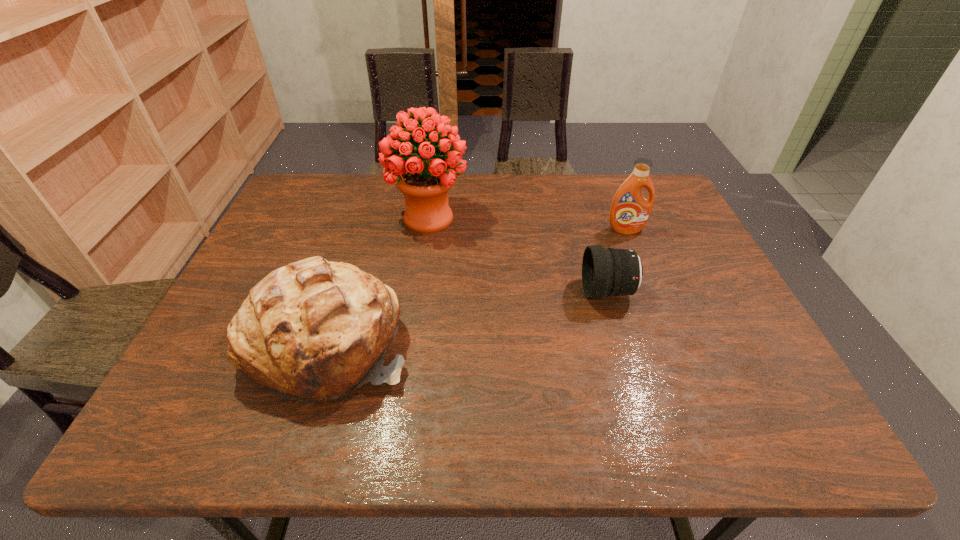
Identify the location of the tallest object. (424, 183).

Where is `detergent`? The image size is (960, 540). detergent is located at coordinates (x=630, y=211).

Locate an element on the screen. The width and height of the screenshot is (960, 540). bread is located at coordinates (314, 330).

Find the location of a particular element. The width and height of the screenshot is (960, 540). telephoto lens is located at coordinates (605, 271).

This screenshot has width=960, height=540. What are the coordinates of `vacant region located on the left of the tallest object` in the screenshot? It's located at (312, 218).

At what (x,y) coordinates should I click in order to perform the action: click on blank space located 0.110m on the front-facing side of the detergent. Please return your answer as a coordinate pair (x, y). The width and height of the screenshot is (960, 540). Looking at the image, I should click on (637, 260).

I want to click on blank area located on the right of the bread, so click(x=529, y=343).

This screenshot has height=540, width=960. I want to click on vacant space situated at the front element of the shortest object, so click(515, 292).

Where is `free point located at the front element of the shortest object`? free point located at the front element of the shortest object is located at coordinates (486, 292).

Locate an element on the screen. Image resolution: width=960 pixels, height=540 pixels. free space located at the front element of the shortest object is located at coordinates 530,292.